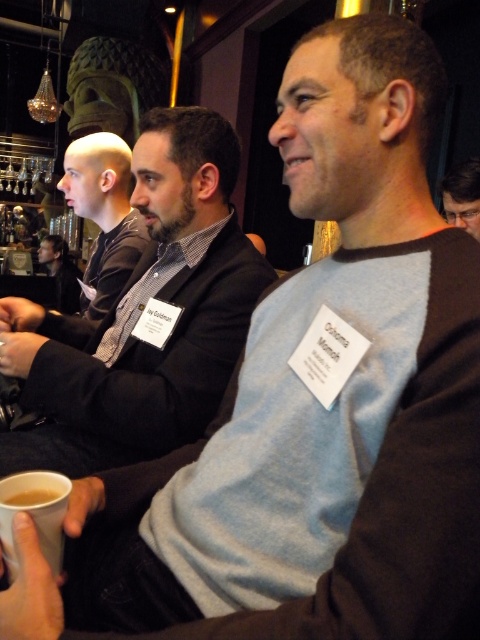
Measure the distance from light blue sweater at center to clear plastic glasses at upper right.

light blue sweater at center and clear plastic glasses at upper right are 36.74 inches apart.

Who is more forward, (144,340) or (446,216)?

Point (144,340)

Which is in front, point (182, 234) or point (444, 211)?

Point (182, 234) is more forward.

Locate an element on the screen. light blue sweater at center is located at coordinates (140, 316).

Is matte black jacket at center shorter than brown matte cup at lower left?

In fact, matte black jacket at center may be taller than brown matte cup at lower left.

From the picture: Does matte black jacket at center lie in front of brown matte cup at lower left?

No, it is not.

Find the location of a particular element. matte black jacket at center is located at coordinates (60, 273).

Identify the location of matte black jacket at center. The width and height of the screenshot is (480, 640). (60, 273).

Find the location of a particular element. This screenshot has width=480, height=640. light blue sweater at center is located at coordinates tap(140, 316).

How distant is light blue sweater at center from brown matte cup at lower left?

They are 23.97 inches apart.

Where is `light blue sweater at center`? light blue sweater at center is located at coordinates (140, 316).